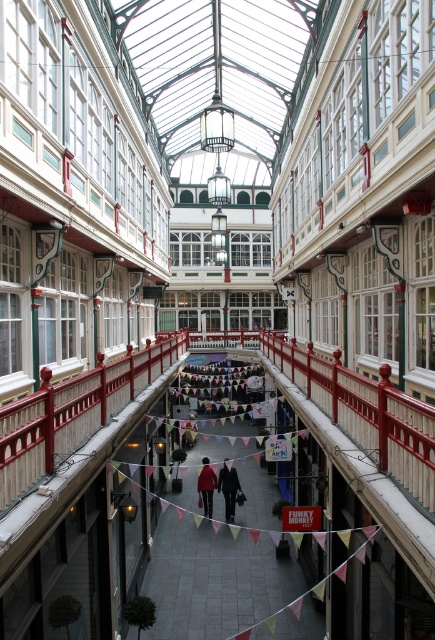
You are designing a new display stand for the atrium and need to choose between placing it next to the wooden railing at center or the red painted metal railing at center. Which railing has a wider space available for the display stand?

The wooden railing at center has a wider space available for the display stand since its width surpasses that of the red painted metal railing at center.